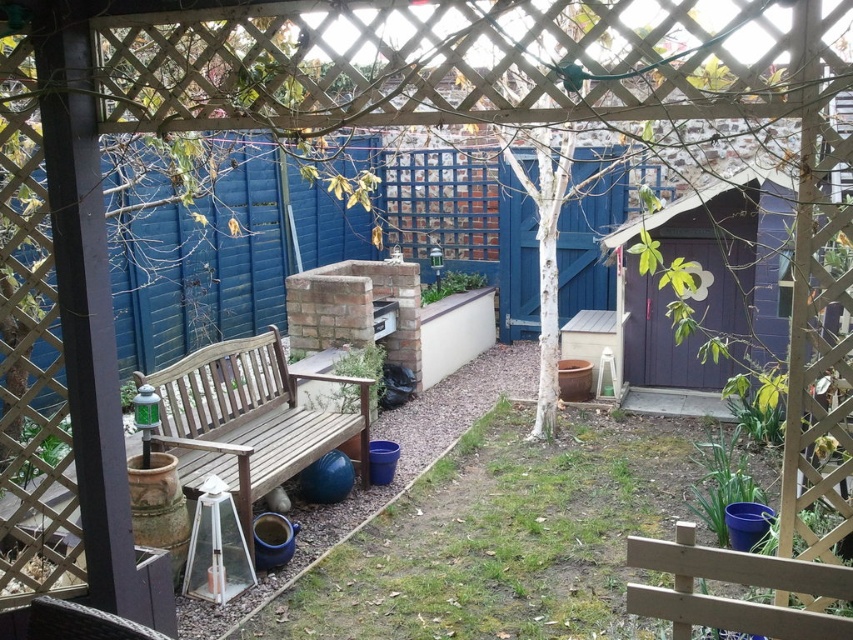
Can you confirm if green grass at center is shorter than wooden bench at center?

Yes, green grass at center is shorter than wooden bench at center.

Who is lower down, green grass at center or wooden bench at center?

green grass at center

Which is behind, point (596, 632) or point (370, 384)?

The point (370, 384) is more distant.

The image size is (853, 640). Find the location of `green grass at center`. green grass at center is located at coordinates (497, 538).